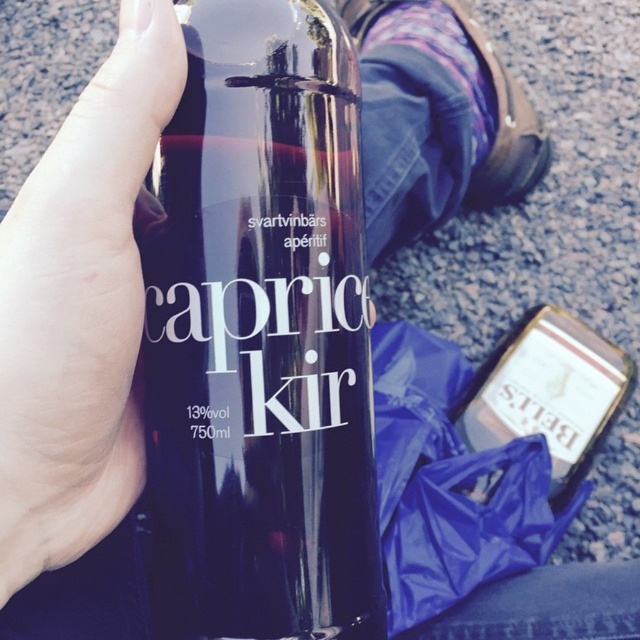
Question: Is glossy glass bottle at upper center positioned in front of smooth skin hand at upper left?

Choices:
 (A) yes
 (B) no

Answer: (B)

Question: Can you confirm if smooth skin hand at upper left is positioned to the left of matte gold bottle at lower right?

Choices:
 (A) no
 (B) yes

Answer: (B)

Question: Which point is farther to the camera?

Choices:
 (A) (584, 362)
 (B) (196, 387)

Answer: (A)

Question: Which object appears closest to the camera in this image?

Choices:
 (A) glossy glass bottle at upper center
 (B) smooth skin hand at upper left
 (C) matte gold bottle at lower right

Answer: (B)

Question: In this image, where is smooth skin hand at upper left located relative to matte gold bottle at lower right?

Choices:
 (A) left
 (B) right

Answer: (A)

Question: Which is nearer to the matte gold bottle at lower right?

Choices:
 (A) glossy glass bottle at upper center
 (B) smooth skin hand at upper left

Answer: (A)